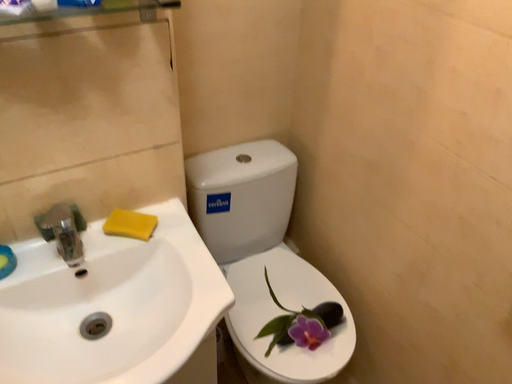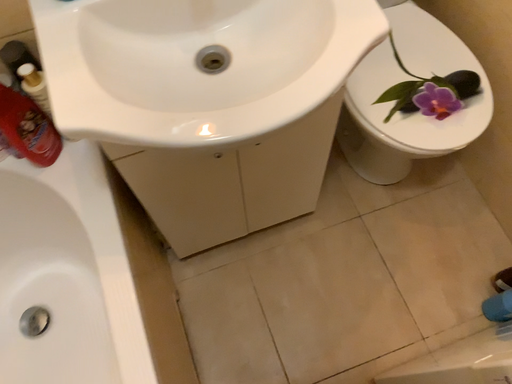
Question: Which way did the camera rotate in the video?

Choices:
 (A) rotated upward
 (B) rotated downward

Answer: (B)